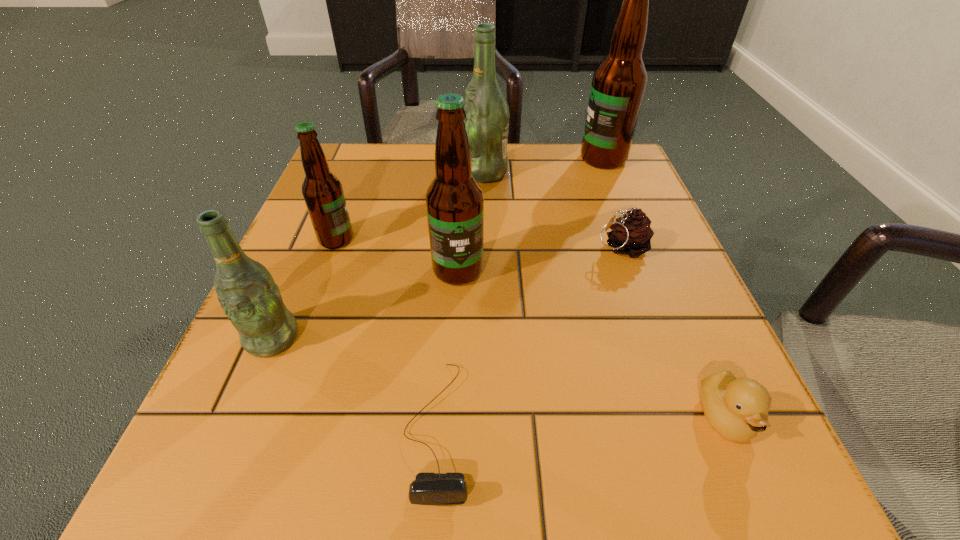
Where is `object that is at the far right corner`? The width and height of the screenshot is (960, 540). object that is at the far right corner is located at coordinates (618, 85).

Locate an element on the screen. Image resolution: width=960 pixels, height=540 pixels. object that is at the near right corner is located at coordinates (737, 409).

This screenshot has width=960, height=540. In the image, there is a desktop. Find the location of `vacant region at the far edge`. vacant region at the far edge is located at coordinates (550, 190).

Locate an element on the screen. The width and height of the screenshot is (960, 540). free space at the near edge is located at coordinates click(650, 512).

In the image, there is a desktop. Where is `free region at the left edge`? The height and width of the screenshot is (540, 960). free region at the left edge is located at coordinates (297, 260).

Locate an element on the screen. vacant space at the right edge of the desktop is located at coordinates (665, 299).

Where is `free space at the far left corner of the desktop`? Image resolution: width=960 pixels, height=540 pixels. free space at the far left corner of the desktop is located at coordinates (372, 183).

Find the location of `free space at the far right corner`. free space at the far right corner is located at coordinates (585, 174).

This screenshot has height=540, width=960. I want to click on empty space between the duckling and the nearest beer bottle, so click(x=498, y=379).

This screenshot has width=960, height=540. Identify the location of free point between the nearer green beer bottle and the smallest brown beer bottle. (304, 289).